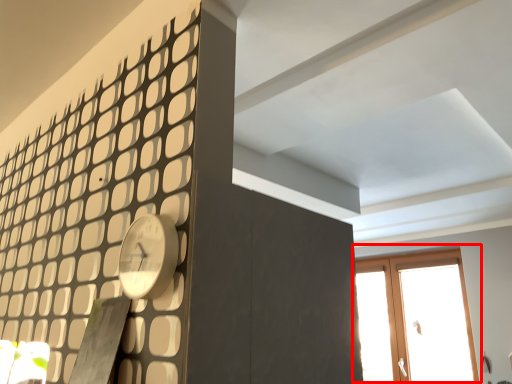
Question: From the image's perspective, what is the correct spatial positioning of window (annotated by the red box) in reference to clock?

Choices:
 (A) above
 (B) below

Answer: (B)